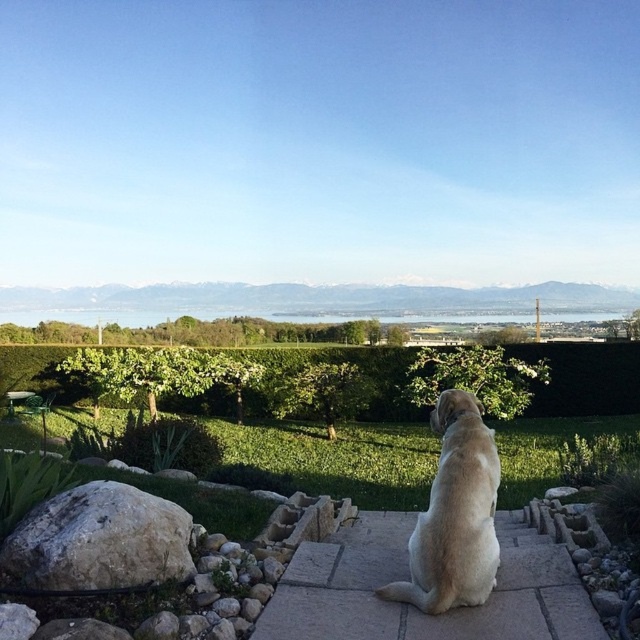
Does white rough rock at lower left have a lesser width compared to green leafy hedge at center?

Indeed, white rough rock at lower left has a lesser width compared to green leafy hedge at center.

Between point (36, 534) and point (595, 406), which one is positioned in front?

Point (36, 534) is in front.

Locate an element on the screen. white rough rock at lower left is located at coordinates (99, 540).

Can you confirm if beige stone steps at center is positioned above green leafy hedge at center?

Incorrect, beige stone steps at center is not positioned above green leafy hedge at center.

Can you confirm if beige stone steps at center is positioned below green leafy hedge at center?

Yes, beige stone steps at center is below green leafy hedge at center.

Locate an element on the screen. beige stone steps at center is located at coordinates (413, 608).

Does white rough rock at lower left have a greater width compared to light brown fur at center?

Indeed, white rough rock at lower left has a greater width compared to light brown fur at center.

Is point (131, 563) farther from viewer compared to point (426, 595)?

No, (131, 563) is closer to viewer.

This screenshot has width=640, height=640. What are the coordinates of `white rough rock at lower left` in the screenshot? It's located at (99, 540).